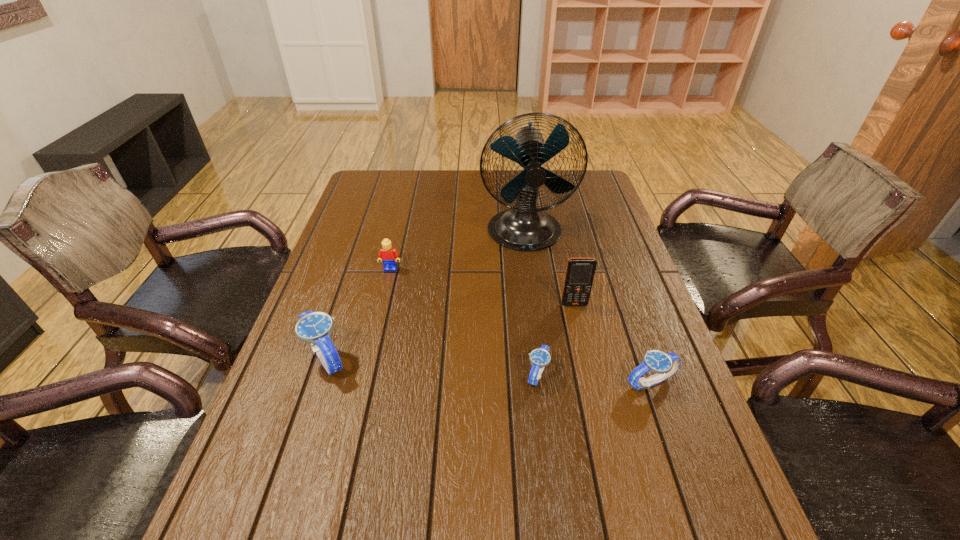
Where is `watch located at the right edge`? watch located at the right edge is located at coordinates tap(664, 364).

Identify the location of fan located at the right edge. Image resolution: width=960 pixels, height=540 pixels. (525, 227).

In the image, there is a desktop. Identify the location of vacant space at the far edge. The width and height of the screenshot is (960, 540). (472, 183).

I want to click on vacant area at the near edge, so click(x=452, y=468).

The width and height of the screenshot is (960, 540). What are the coordinates of `blank space at the left edge of the desktop` in the screenshot? It's located at (291, 379).

Where is `free space at the right edge`? This screenshot has width=960, height=540. free space at the right edge is located at coordinates (588, 216).

Locate an element on the screen. This screenshot has height=540, width=960. free space at the near left corner of the desktop is located at coordinates (294, 470).

Image resolution: width=960 pixels, height=540 pixels. In order to click on vacant area at the far right corner of the desktop in this screenshot , I will do `click(601, 188)`.

What are the coordinates of `blank region between the cellular telephone and the Lego` in the screenshot? It's located at (483, 287).

The width and height of the screenshot is (960, 540). What are the coordinates of `free space that is in between the leftmost object and the second object from left to right` in the screenshot? It's located at (358, 313).